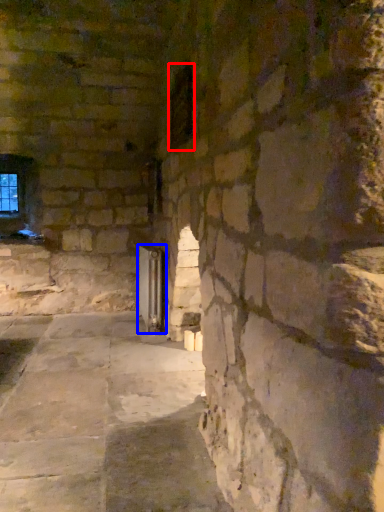
Question: Which object is closer to the camera taking this photo, window (highlighted by a red box) or glass door (highlighted by a blue box)?

Choices:
 (A) window
 (B) glass door

Answer: (A)